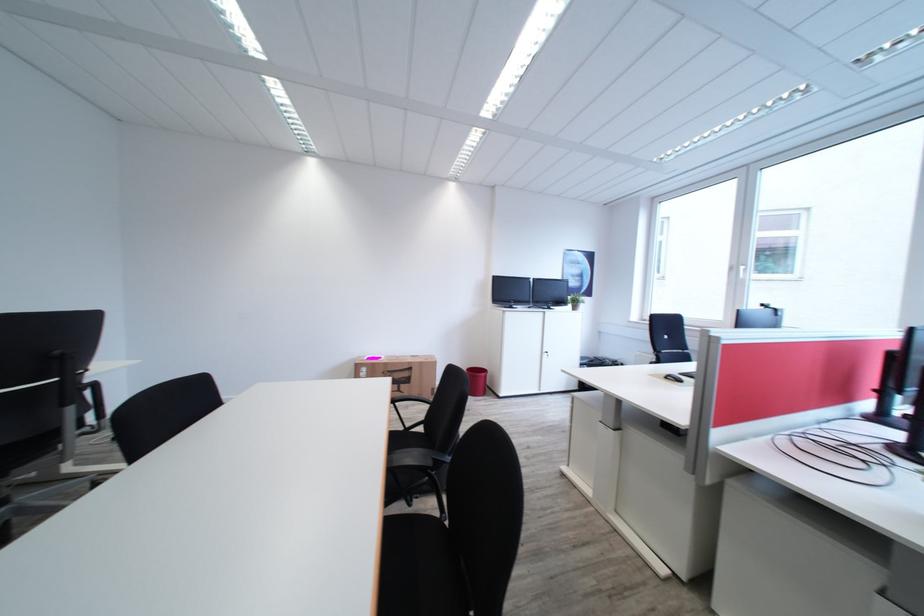
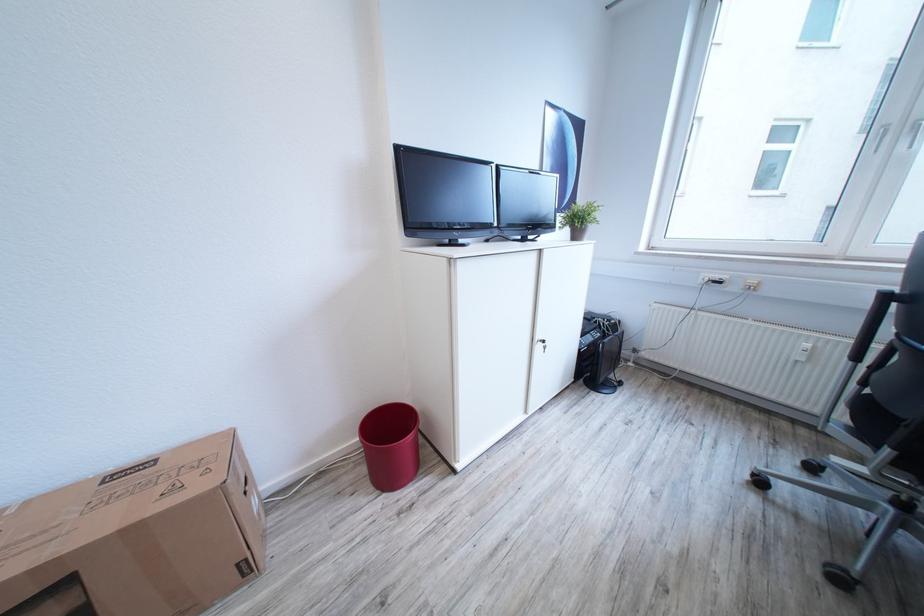
Question: Which direction would the cameraman need to move to produce the second image? Reply with the corresponding letter.

Choices:
 (A) Left
 (B) Right
 (C) Forward
 (D) Backward

Answer: (C)